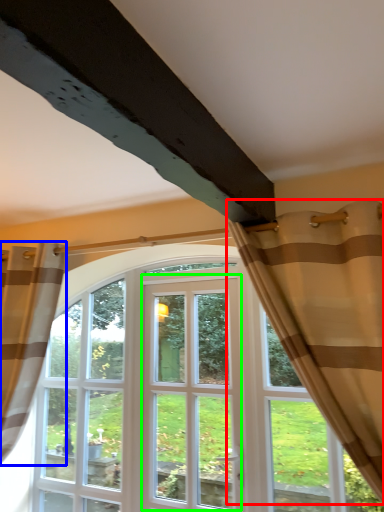
Question: Based on their relative distances, which object is nearer to curtain (highlighted by a red box)? Choose from curtain (highlighted by a blue box) and screen door (highlighted by a green box).

Choices:
 (A) curtain
 (B) screen door

Answer: (B)